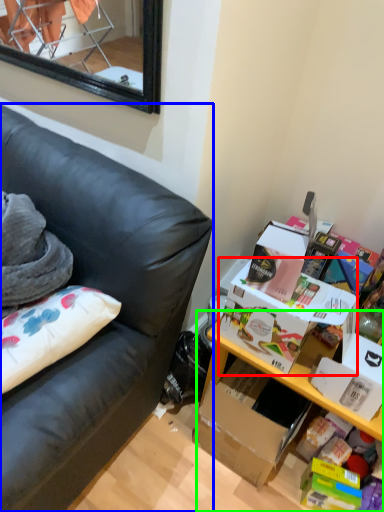
Question: Which object is the closest to the storage box (highlighted by a red box)? Choose among these: studio couch (highlighted by a blue box) or table (highlighted by a green box).

Choices:
 (A) studio couch
 (B) table

Answer: (B)